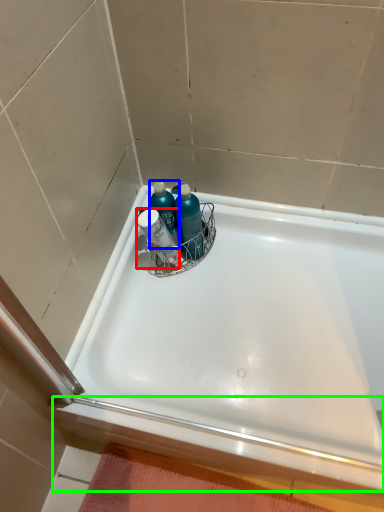
Question: Estimate the real-world distances between objects in this image. Which object is closer to mouthwash (highlighted by a red box), cleaning product (highlighted by a blue box) or ledge (highlighted by a green box)?

Choices:
 (A) cleaning product
 (B) ledge

Answer: (A)